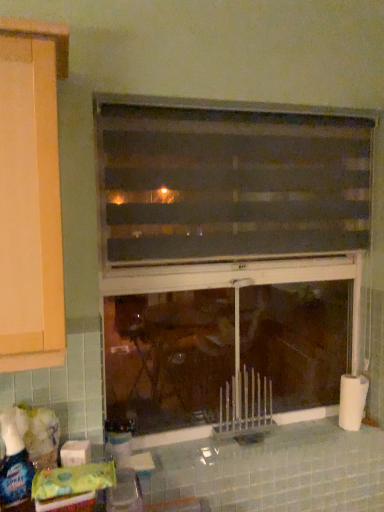
Question: From the image's perspective, is white matte toilet paper at lower left, positioned as the 1th toilet paper in front-to-back order, beneath translucent plastic bottle at lower left, the 2th bottle viewed from the front?

Choices:
 (A) yes
 (B) no

Answer: (B)

Question: Is translucent plastic bottle at lower left, arranged as the second bottle when viewed from the left, at the back of white matte toilet paper at lower left, marked as the 1th toilet paper in a left-to-right arrangement?

Choices:
 (A) no
 (B) yes

Answer: (B)

Question: From the image's perspective, is white matte toilet paper at lower left, positioned as the 1th toilet paper in front-to-back order, on translucent plastic bottle at lower left, the 2th bottle viewed from the front?

Choices:
 (A) yes
 (B) no

Answer: (A)

Question: Is white matte toilet paper at lower left, marked as the 1th toilet paper in a left-to-right arrangement, to the left of translucent plastic bottle at lower left, the first bottle viewed from the back, from the viewer's perspective?

Choices:
 (A) no
 (B) yes

Answer: (B)

Question: Is white matte toilet paper at lower left, which ranks as the 2th toilet paper in right-to-left order, oriented towards translucent plastic bottle at lower left, the first bottle viewed from the back?

Choices:
 (A) yes
 (B) no

Answer: (B)

Question: In terms of size, does translucent plastic bottle at lower left, the 2th bottle viewed from the front, appear bigger or smaller than black matte window at center, the second window positioned from the top?

Choices:
 (A) small
 (B) big

Answer: (A)

Question: Considering their positions, is translucent plastic bottle at lower left, the first bottle viewed from the back, located in front of or behind black matte window at center, marked as the 1th window in a bottom-to-top arrangement?

Choices:
 (A) behind
 (B) front

Answer: (A)

Question: From the image's perspective, is translucent plastic bottle at lower left, the 2th bottle viewed from the front, positioned above or below black matte window at center, marked as the 1th window in a bottom-to-top arrangement?

Choices:
 (A) below
 (B) above

Answer: (A)

Question: From their relative heights in the image, would you say translucent plastic bottle at lower left, arranged as the second bottle when viewed from the left, is taller or shorter than black matte window at center, marked as the 1th window in a bottom-to-top arrangement?

Choices:
 (A) short
 (B) tall

Answer: (A)

Question: Is black matte window at center, marked as the 1th window in a bottom-to-top arrangement, bigger or smaller than white matte toilet paper at right, which ranks as the 1th toilet paper in right-to-left order?

Choices:
 (A) small
 (B) big

Answer: (B)

Question: Do you think black matte window at center, the second window positioned from the top, is within white matte toilet paper at right, which ranks as the 1th toilet paper in right-to-left order, or outside of it?

Choices:
 (A) inside
 (B) outside

Answer: (B)

Question: From the image's perspective, is black matte window at center, marked as the 1th window in a bottom-to-top arrangement, above or below white matte toilet paper at right, which is counted as the 2th toilet paper, starting from the front?

Choices:
 (A) below
 (B) above

Answer: (B)

Question: From a real-world perspective, is black matte window at center, the second window positioned from the top, positioned above or below white matte toilet paper at right, the first toilet paper when ordered from back to front?

Choices:
 (A) below
 (B) above

Answer: (B)

Question: Does point (82, 451) appear closer or farther from the camera than point (4, 425)?

Choices:
 (A) closer
 (B) farther

Answer: (B)

Question: From a real-world perspective, relative to translucent plastic spray bottle at lower left, which appears as the 2th bottle when viewed from the right, is white matte toilet paper at lower left, which ranks as the 2th toilet paper in right-to-left order, vertically above or below?

Choices:
 (A) above
 (B) below

Answer: (B)